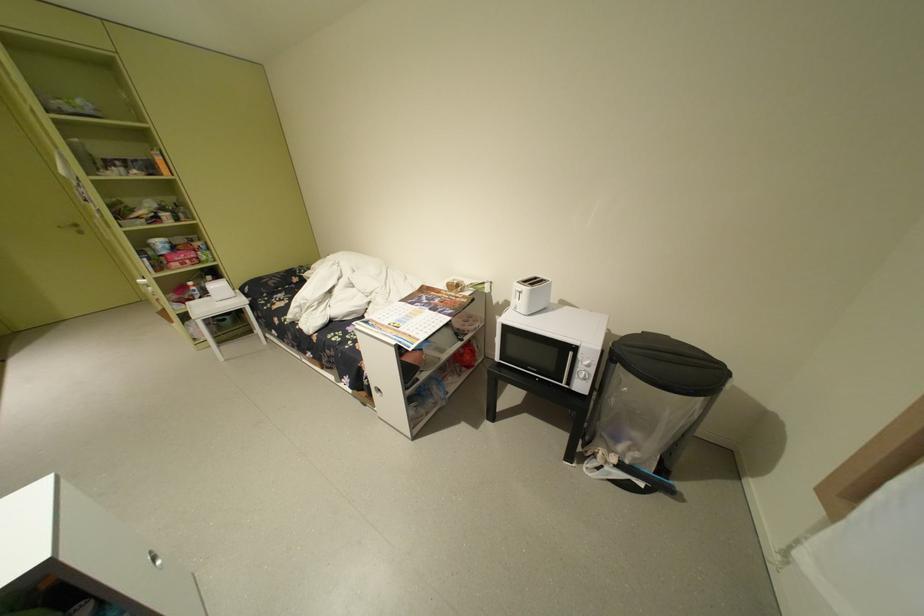
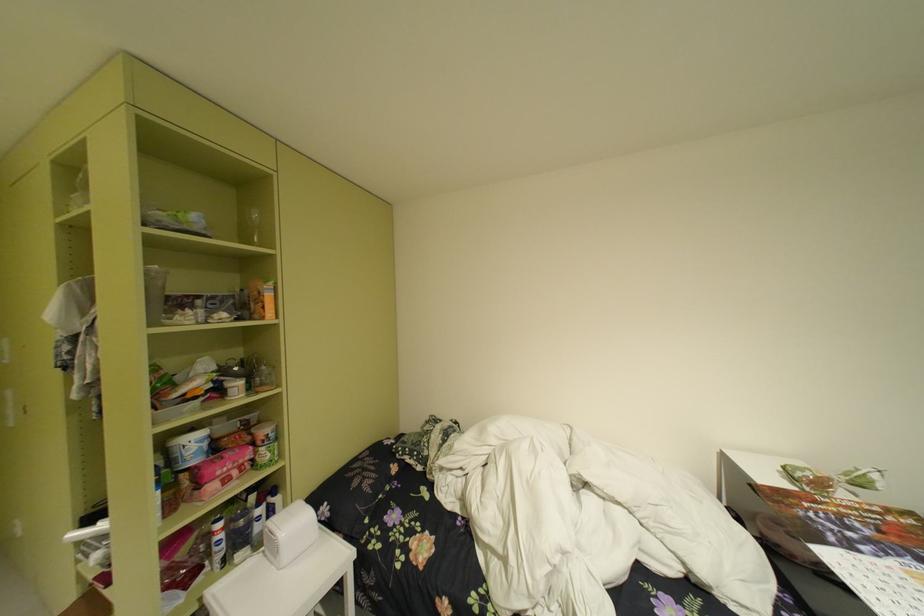
In the second image, find the point that corresponds to [204,286] in the first image.

(235, 528)